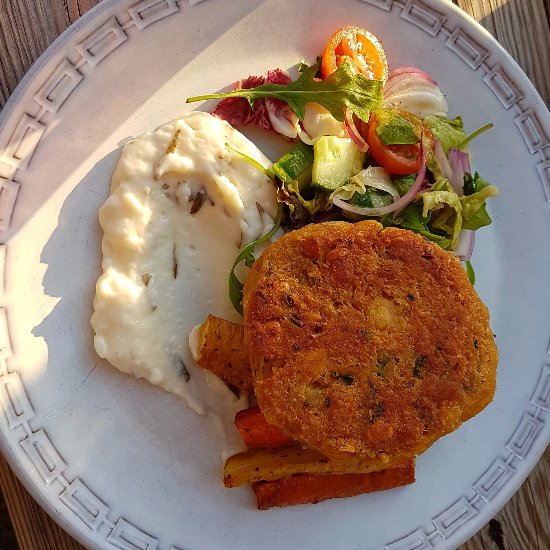
Where is `bottom of plate`? bottom of plate is located at coordinates (279, 527).